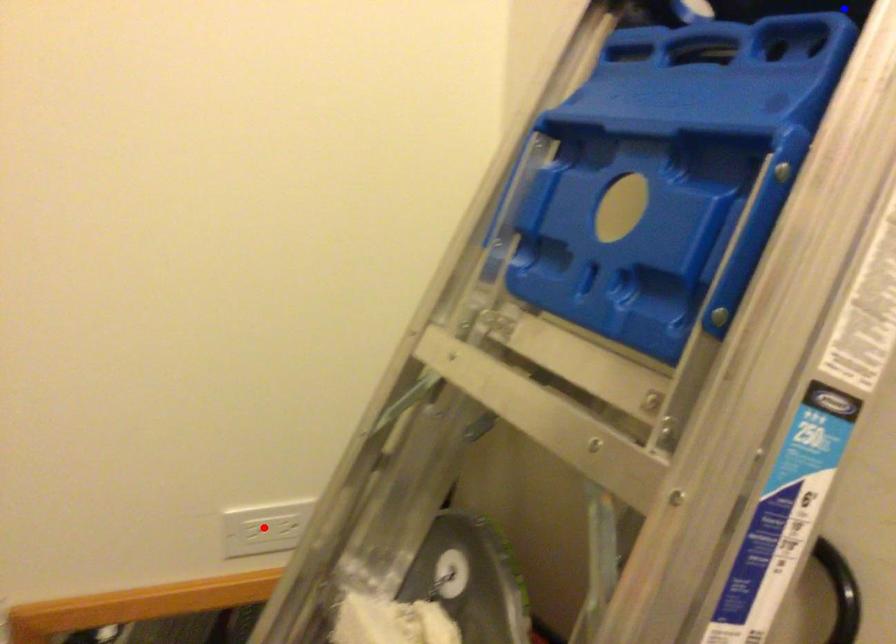
Question: Which of the two points in the image is closer to the camera?

Choices:
 (A) Blue point is closer.
 (B) Red point is closer.

Answer: (A)